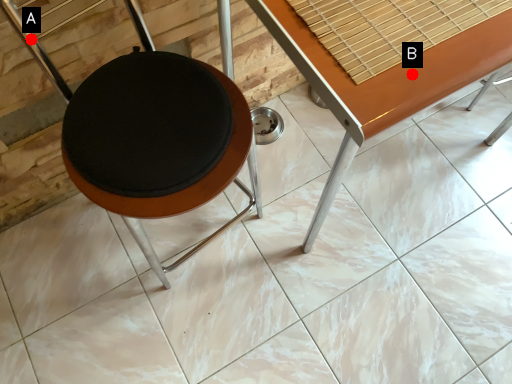
Question: Two points are circled on the image, labeled by A and B beside each circle. Which point is closer to the camera taking this photo?

Choices:
 (A) A is closer
 (B) B is closer

Answer: (B)